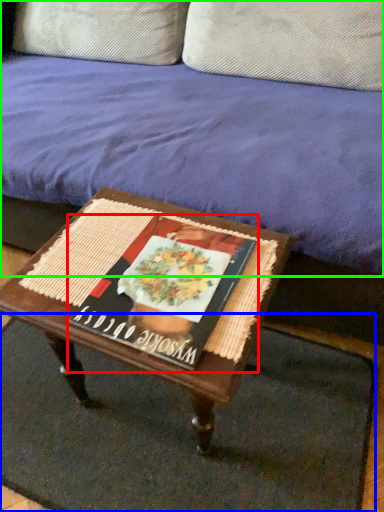
Question: Which object is positioned farthest from magazine (highlighted by a red box)? Select from doormat (highlighted by a blue box) and studio couch (highlighted by a green box).

Choices:
 (A) doormat
 (B) studio couch

Answer: (A)